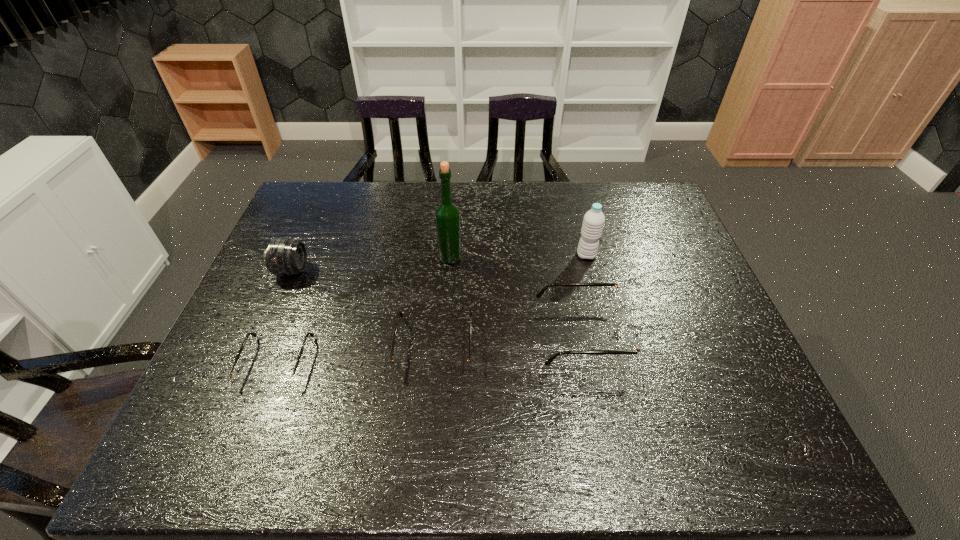
Locate an element on the screen. This screenshot has width=960, height=540. the leftmost spectacles is located at coordinates (279, 380).

Where is `the shortest object`? the shortest object is located at coordinates (279, 380).

Image resolution: width=960 pixels, height=540 pixels. I want to click on the second shortest object, so click(402, 367).

Locate an element on the screen. This screenshot has height=540, width=960. the second shortest spectacles is located at coordinates (402, 367).

At what (x,y) coordinates should I click in order to perform the action: click on the rightmost spectacles. Please return your answer as a coordinate pair (x, y). The height and width of the screenshot is (540, 960). Looking at the image, I should click on (632, 344).

You are a GUI agent. You are given a task and a screenshot of the screen. Output one action in this format:
    pyautogui.click(x=<x>, y=<y>)
    Task: Click on the third shortest object
    The height and width of the screenshot is (540, 960).
    Given the screenshot: What is the action you would take?
    pyautogui.click(x=632, y=344)

This screenshot has width=960, height=540. I want to click on the fourth shortest object, so click(284, 256).

Identify the location of liquor. (447, 214).

Locate an element on the screen. The height and width of the screenshot is (540, 960). the fifth shortest object is located at coordinates (593, 222).

Where is `free space located 0.060m at the hinge ends of the third shortest object`? This screenshot has height=540, width=960. free space located 0.060m at the hinge ends of the third shortest object is located at coordinates (651, 332).